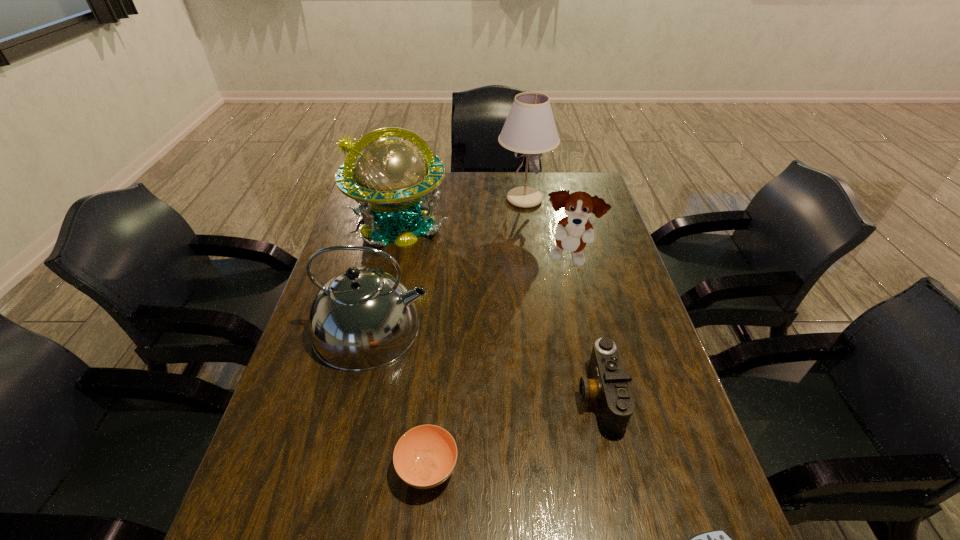
Find the location of a particular element. This screenshot has height=540, width=960. lampshade is located at coordinates (530, 128).

Find the location of `globe`. globe is located at coordinates (391, 179).

The width and height of the screenshot is (960, 540). Find the location of `kettle`. kettle is located at coordinates (362, 319).

Find the location of a particular element. puppy is located at coordinates (572, 233).

The image size is (960, 540). Find the location of `camera`. camera is located at coordinates (608, 386).

You are a GUI agent. You are given a task and a screenshot of the screen. Output one action in this format:
    pyautogui.click(x=<x>, y=<y>)
    Task: Click on the soup bowl
    The width and height of the screenshot is (960, 540).
    Given the screenshot: What is the action you would take?
    pyautogui.click(x=424, y=457)

At what (x,y) coordinates should I click in order to perform the action: click on the sixth farthest object. Please return your answer as a coordinate pair (x, y). The height and width of the screenshot is (540, 960). Looking at the image, I should click on pyautogui.click(x=424, y=457).

Find the location of a particular element. The image size is (960, 540). vacant region located 0.050m on the front of the lampshade is located at coordinates (528, 224).

The height and width of the screenshot is (540, 960). Find the location of `blank area located 0.300m on the front of the globe`. blank area located 0.300m on the front of the globe is located at coordinates (373, 329).

Where is `free region located from the spout of the kettle`? Image resolution: width=960 pixels, height=540 pixels. free region located from the spout of the kettle is located at coordinates (557, 328).